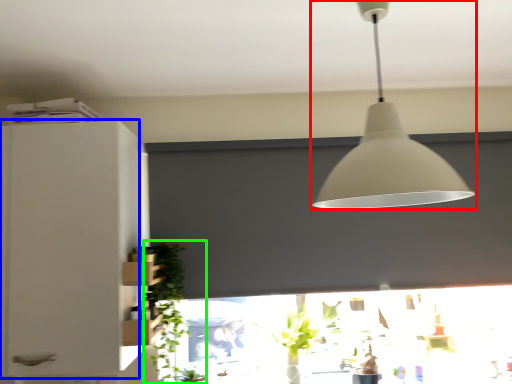
Question: Which is farther away from lamp (highlighted by a red box)? cabinetry (highlighted by a blue box) or plant (highlighted by a green box)?

Choices:
 (A) cabinetry
 (B) plant

Answer: (B)